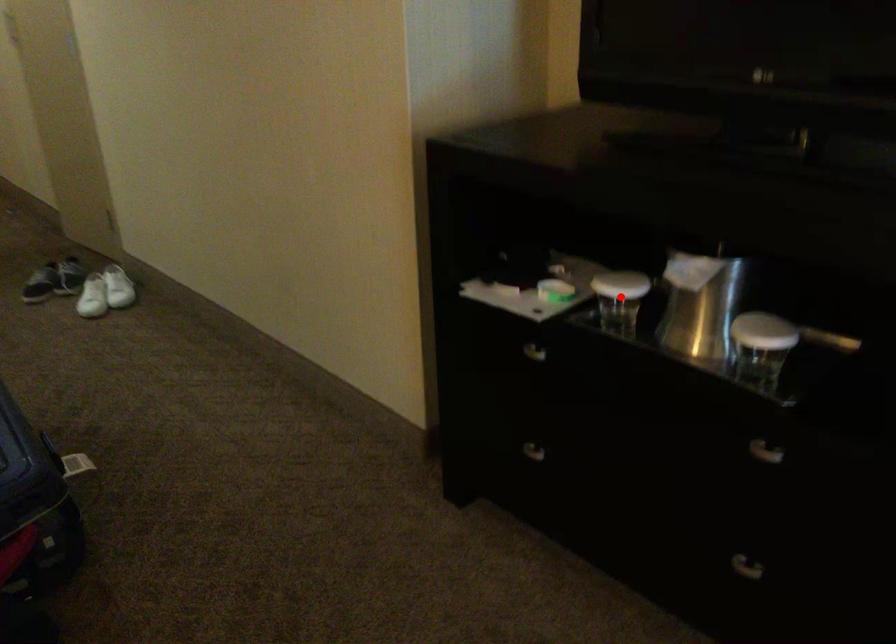
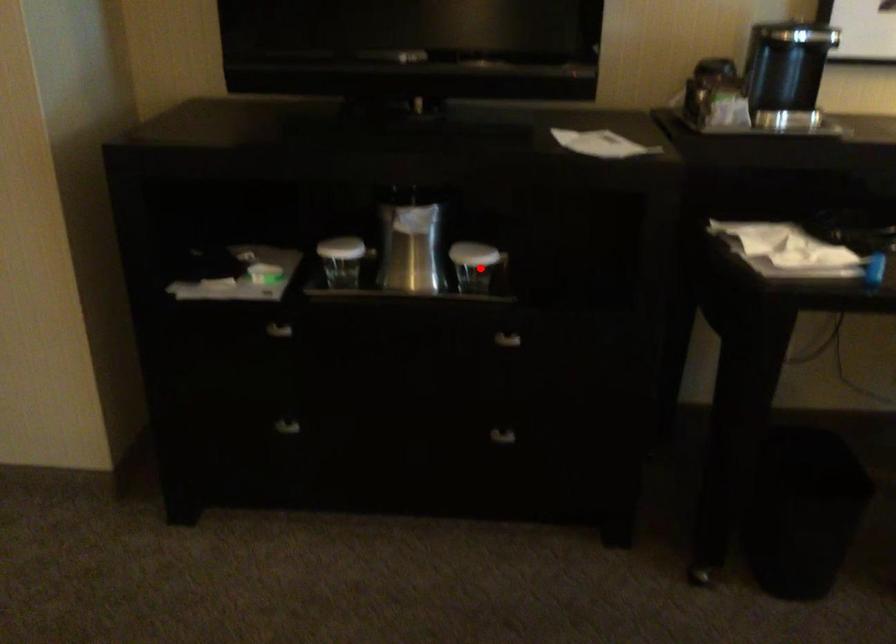
I am providing you with two images of the same scene from different viewpoints. A red point is marked on the first image and another point is marked on the second image. Are the points marked in image1 and image2 representing the same 3D position?

No